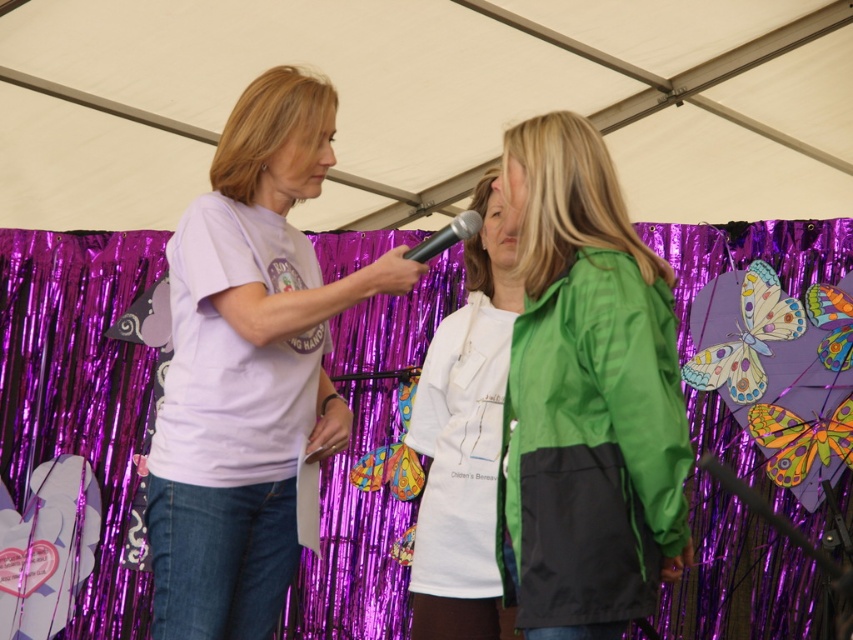
Question: Is white matte shirt at center wider than black matte microphone at center?

Choices:
 (A) yes
 (B) no

Answer: (A)

Question: Which is farther from the black matte microphone at center?

Choices:
 (A) green matte jacket at center
 (B) white matte shirt at center

Answer: (A)

Question: Is matte white t-shirt at center further to the viewer compared to green matte jacket at center?

Choices:
 (A) no
 (B) yes

Answer: (B)

Question: Which point is closer to the camera taking this photo?

Choices:
 (A) (459, 236)
 (B) (525, 502)
 (C) (427, 422)

Answer: (B)

Question: Estimate the real-world distances between objects in this image. Which object is closer to the white matte shirt at center?

Choices:
 (A) green matte jacket at center
 (B) matte white t-shirt at center
 (C) black matte microphone at center

Answer: (C)

Question: Can you confirm if matte white t-shirt at center is smaller than green matte jacket at center?

Choices:
 (A) yes
 (B) no

Answer: (B)